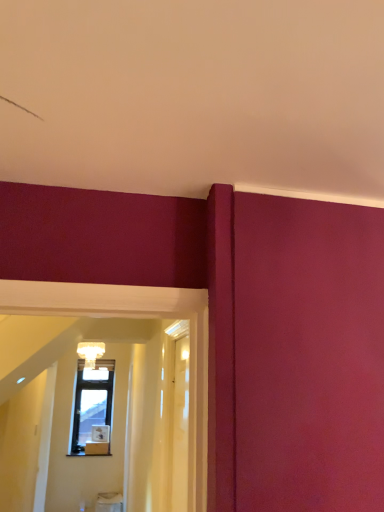
Question: Is matte glass chandelier at upper center positioned in front of transparent glass door at center, marked as the second glass door in a left-to-right arrangement?

Choices:
 (A) yes
 (B) no

Answer: (B)

Question: Could you tell me if matte glass chandelier at upper center is turned towards transparent glass door at center, marked as the 1th glass door in a right-to-left arrangement?

Choices:
 (A) no
 (B) yes

Answer: (B)

Question: From a real-world perspective, is matte glass chandelier at upper center below transparent glass door at center, marked as the 1th glass door in a right-to-left arrangement?

Choices:
 (A) yes
 (B) no

Answer: (B)

Question: Does matte glass chandelier at upper center have a lesser height compared to transparent glass door at center, marked as the second glass door in a left-to-right arrangement?

Choices:
 (A) yes
 (B) no

Answer: (A)

Question: Does matte glass chandelier at upper center appear on the left side of transparent glass door at center, marked as the second glass door in a left-to-right arrangement?

Choices:
 (A) yes
 (B) no

Answer: (A)

Question: Is matte glass chandelier at upper center positioned with its back to transparent glass door at center, marked as the 1th glass door in a right-to-left arrangement?

Choices:
 (A) no
 (B) yes

Answer: (A)

Question: Considering the relative sizes of transparent wood door at center, marked as the second glass door in a right-to-left arrangement, and transparent glass door at center, marked as the second glass door in a left-to-right arrangement, in the image provided, is transparent wood door at center, marked as the second glass door in a right-to-left arrangement, smaller than transparent glass door at center, marked as the second glass door in a left-to-right arrangement,?

Choices:
 (A) no
 (B) yes

Answer: (B)

Question: From the image's perspective, is transparent wood door at center, acting as the first glass door starting from the left, under transparent glass door at center, marked as the 1th glass door in a right-to-left arrangement?

Choices:
 (A) yes
 (B) no

Answer: (A)

Question: Are transparent wood door at center, acting as the first glass door starting from the left, and transparent glass door at center, marked as the 1th glass door in a right-to-left arrangement, located far from each other?

Choices:
 (A) no
 (B) yes

Answer: (A)

Question: From the image's perspective, is transparent wood door at center, marked as the second glass door in a right-to-left arrangement, on top of transparent glass door at center, marked as the 1th glass door in a right-to-left arrangement?

Choices:
 (A) yes
 (B) no

Answer: (B)

Question: Considering the relative sizes of transparent wood door at center, acting as the first glass door starting from the left, and transparent glass door at center, marked as the 1th glass door in a right-to-left arrangement, in the image provided, is transparent wood door at center, acting as the first glass door starting from the left, shorter than transparent glass door at center, marked as the 1th glass door in a right-to-left arrangement,?

Choices:
 (A) no
 (B) yes

Answer: (B)

Question: Is transparent wood door at center, marked as the second glass door in a right-to-left arrangement, oriented towards transparent glass door at center, marked as the 1th glass door in a right-to-left arrangement?

Choices:
 (A) no
 (B) yes

Answer: (B)

Question: Is matte glass chandelier at upper center located within transparent glass door at center, marked as the 1th glass door in a right-to-left arrangement?

Choices:
 (A) yes
 (B) no

Answer: (B)